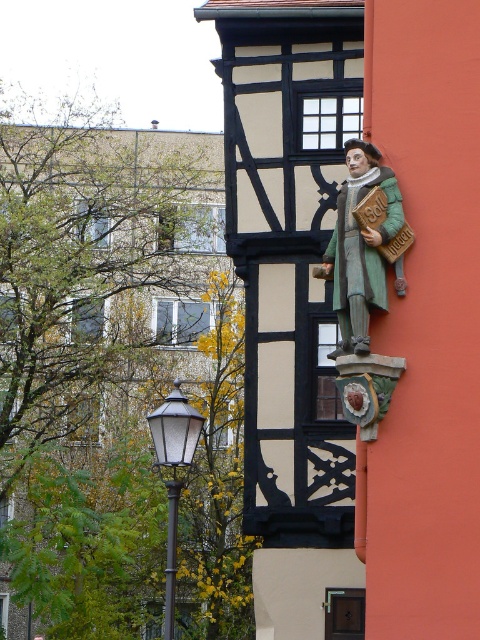
Question: Does green carved wood figure at center come behind matte black lamp post at lower left?

Choices:
 (A) yes
 (B) no

Answer: (B)

Question: Is green carved wood figure at center positioned in front of matte black lamp post at lower left?

Choices:
 (A) no
 (B) yes

Answer: (B)

Question: Estimate the real-world distances between objects in this image. Which object is closer to the green carved wood figure at center?

Choices:
 (A) metallic pole at lower left
 (B) matte black lamp post at lower left

Answer: (B)

Question: Which object is closer to the camera taking this photo?

Choices:
 (A) metallic pole at lower left
 (B) matte black lamp post at lower left

Answer: (B)

Question: Which object appears closest to the camera in this image?

Choices:
 (A) metallic pole at lower left
 (B) green carved wood figure at center
 (C) matte black lamp post at lower left

Answer: (B)

Question: From the image, what is the correct spatial relationship of green carved wood figure at center in relation to matte black lamp post at lower left?

Choices:
 (A) below
 (B) above

Answer: (B)